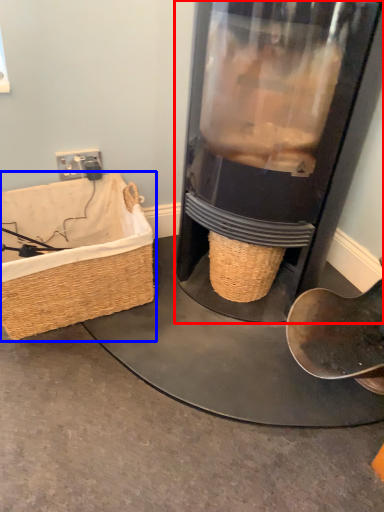
Question: Which object appears farthest to the camera in this image, appliance (highlighted by a red box) or picnic basket (highlighted by a blue box)?

Choices:
 (A) appliance
 (B) picnic basket

Answer: (B)